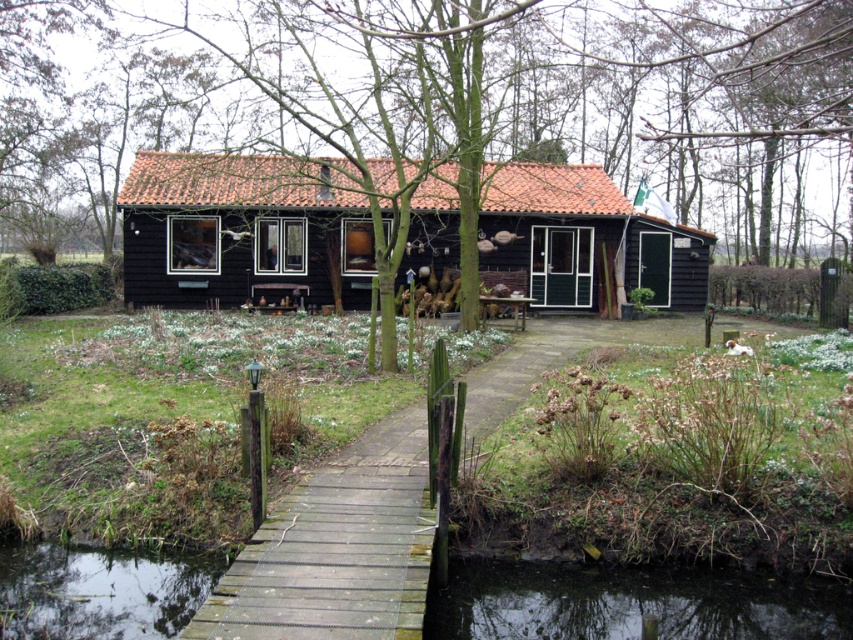
Question: Can you confirm if black wood cottage at center is bigger than black water at lower left?

Choices:
 (A) yes
 (B) no

Answer: (A)

Question: Does black water at lower left appear on the right side of transparent water at bridge bottom?

Choices:
 (A) no
 (B) yes

Answer: (B)

Question: Which of the following is the closest to the observer?

Choices:
 (A) (97, 627)
 (B) (625, 600)
 (C) (113, 99)
 (D) (537, 253)

Answer: (A)

Question: Which point is closer to the camera?

Choices:
 (A) (508, 604)
 (B) (126, 604)

Answer: (B)

Question: Does black water at lower left appear on the left side of transparent water at bridge bottom?

Choices:
 (A) no
 (B) yes

Answer: (A)

Question: Which point is farther to the camera?

Choices:
 (A) (363, 220)
 (B) (170, 582)
 (C) (821, 593)

Answer: (A)